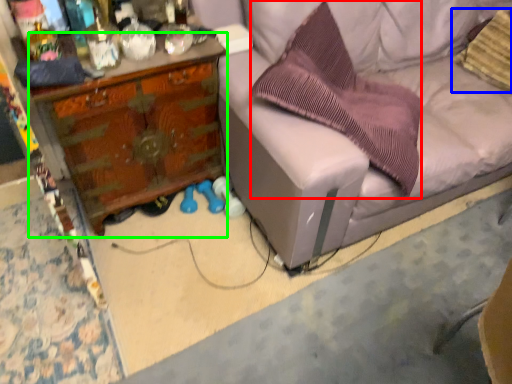
Question: Based on their relative distances, which object is farther from pillow (highlighted by a red box)? Choose from pillow (highlighted by a blue box) and desk (highlighted by a green box).

Choices:
 (A) pillow
 (B) desk

Answer: (A)